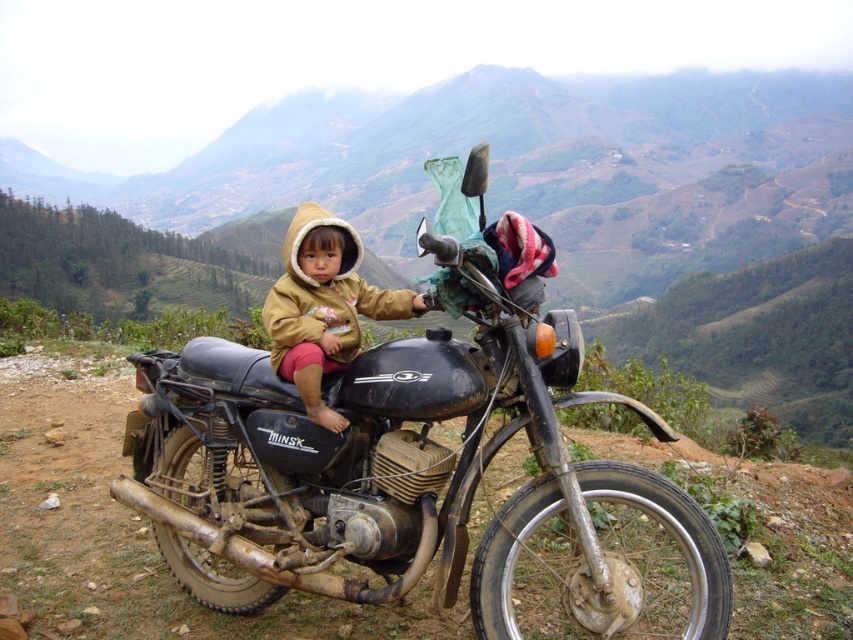
Question: Where is black matte motorcycle at center located in relation to fuzzy brown jacket at center in the image?

Choices:
 (A) above
 (B) below

Answer: (B)

Question: Where is black matte motorcycle at center located in relation to fuzzy brown jacket at center in the image?

Choices:
 (A) below
 (B) above

Answer: (A)

Question: Among these objects, which one is farthest from the camera?

Choices:
 (A) fuzzy brown jacket at center
 (B) black matte motorcycle at center

Answer: (A)

Question: Among these objects, which one is farthest from the camera?

Choices:
 (A) fuzzy brown jacket at center
 (B) black matte motorcycle at center

Answer: (A)

Question: Does black matte motorcycle at center appear on the right side of fuzzy brown jacket at center?

Choices:
 (A) yes
 (B) no

Answer: (A)